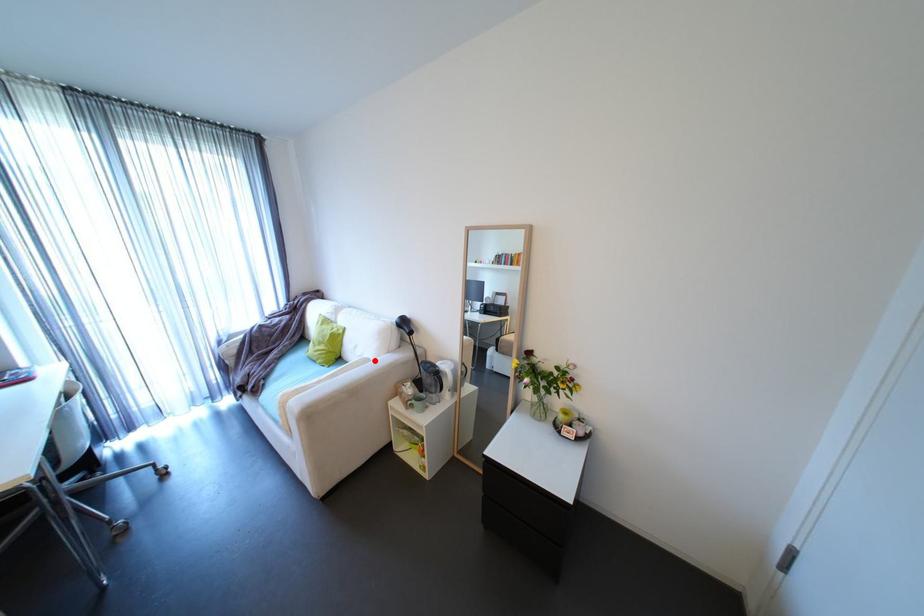
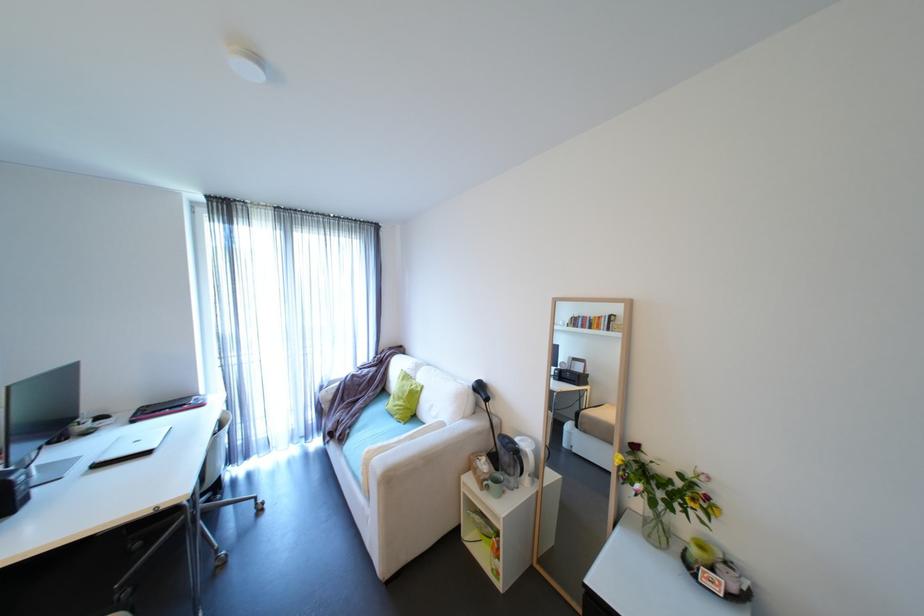
Question: I am providing you with two images of the same scene from different viewpoints. A red point is shown in image1. For the corresponding object point in image2, is it positioned nearer or farther from the camera?

Choices:
 (A) Nearer
 (B) Farther

Answer: (B)